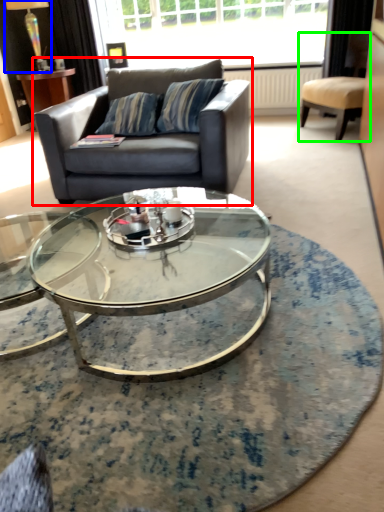
Question: Estimate the real-world distances between objects in this image. Which object is closer to studio couch (highlighted by a red box), lamp (highlighted by a blue box) or chair (highlighted by a green box)?

Choices:
 (A) lamp
 (B) chair

Answer: (B)